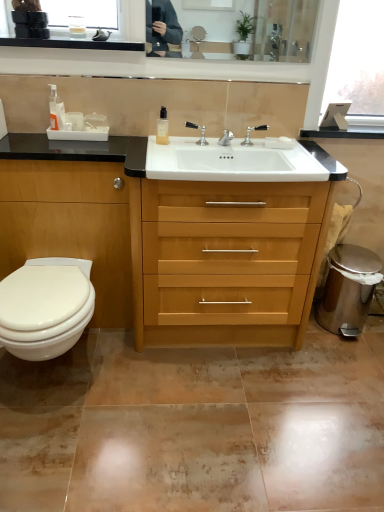
Where is `free space in front of light wood/finish chest of drawers at center`? free space in front of light wood/finish chest of drawers at center is located at coordinates click(219, 416).